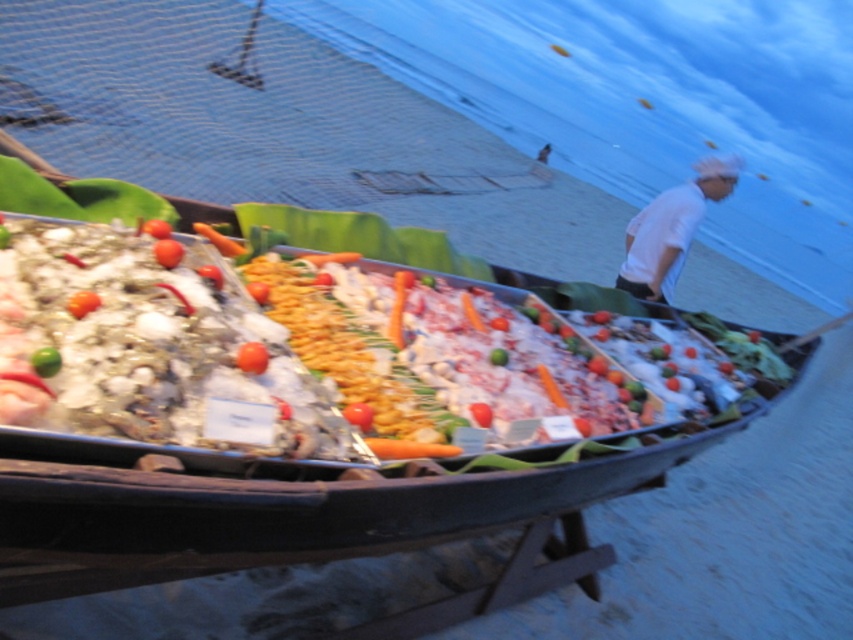
In the scene shown: You are standing on the beach looking at the boat filled with food. Which object is closer to you between the smooth orange tomato at center and the carrot at center?

The smooth orange tomato at center is closer to the viewer than the carrot at center.

You are a food vendor who wants to arrange two garnishes on a plate. You have a red smooth tomato at center and a carrot at center. Which garnish should you choose if you want the one with the larger width?

The red smooth tomato at center has a larger width than the carrot at center, so you should choose the red smooth tomato at center.